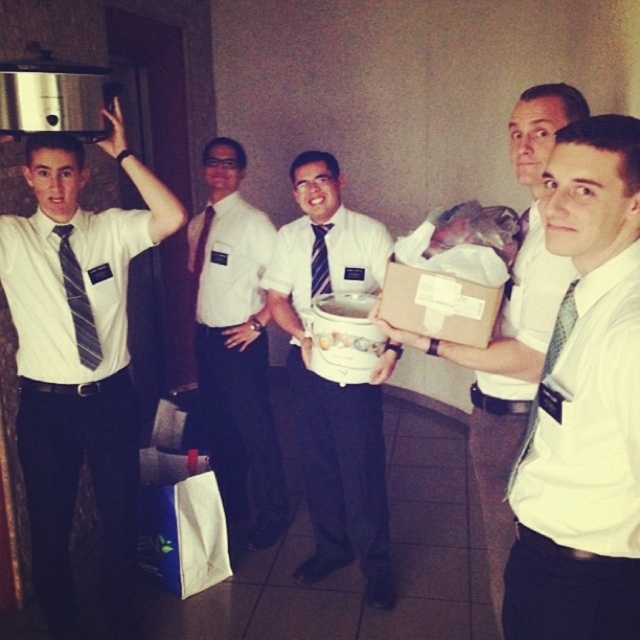
You are organizing a charity event and need to determine which item takes up more space in storage. You have a matte white shirt at center and a matte white bucket at center. Which object requires more storage space?

The matte white bucket at center requires more storage space because it occupies more space than the matte white shirt at center according to the description.

You are standing in the hallway and need to place a new potted plant exactly at the coordinates point 0.6, 0.5. There is a matte white bucket at center. Can you place the plant at the desired coordinates without moving the bucket?

The matte white bucket at center is located at point (336,381). Since the desired coordinates are (320,384), which is very close but not exactly the same, you can place the plant there without moving the bucket as the slight difference in coordinates allows space.

You are a photographer trying to capture a candid shot of the matte white shirt at center and the matte white bucket at center. Since you want to focus on the shirt, which object should you position closer to the camera?

The matte white shirt at center is shorter than the matte white bucket at center, so to focus on the shirt, position the matte white shirt at center closer to the camera to ensure it appears larger in the frame.